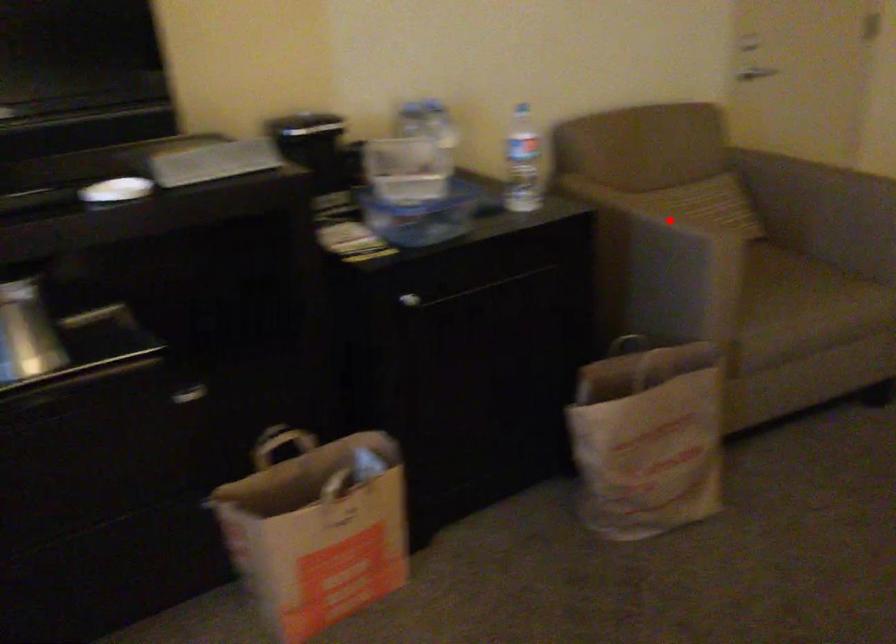
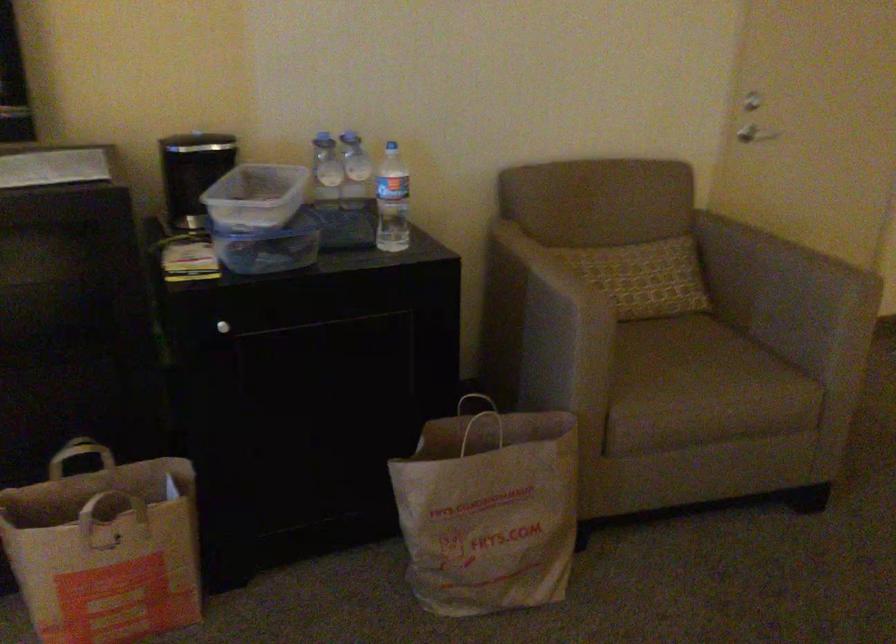
The point at the highlighted location is marked in the first image. Where is the corresponding point in the second image?

(552, 281)